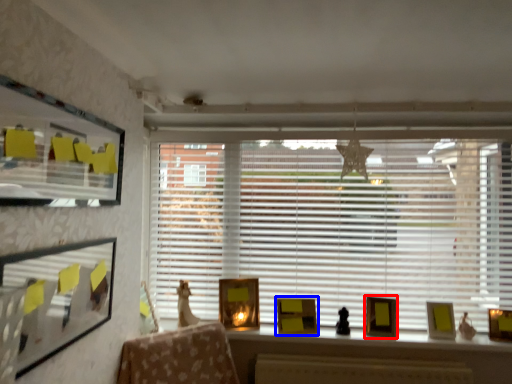
Question: Which object is closer to the camera taking this photo, picture frame (highlighted by a red box) or picture frame (highlighted by a blue box)?

Choices:
 (A) picture frame
 (B) picture frame

Answer: (A)